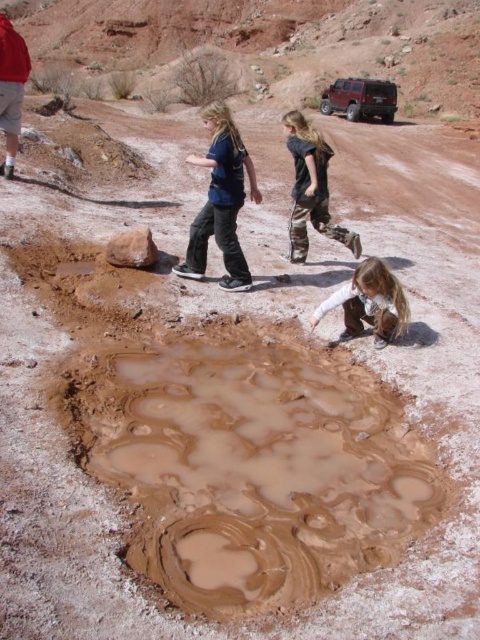
Question: Considering the real-world distances, which object is closest to the matte red shirt at upper left?

Choices:
 (A) light brown fabric pants at lower center
 (B) muddy wet puddle at center

Answer: (A)

Question: Estimate the real-world distances between objects in this image. Which object is farther from the blue cotton shirt at center?

Choices:
 (A) light brown fabric pants at lower center
 (B) matte red shirt at upper left
 (C) dark blue jeans at center

Answer: (B)

Question: Is dark blue jeans at center above light brown fabric pants at lower center?

Choices:
 (A) no
 (B) yes

Answer: (B)

Question: Is muddy wet puddle at center bigger than blue cotton shirt at center?

Choices:
 (A) no
 (B) yes

Answer: (A)

Question: Can you confirm if muddy wet puddle at center is smaller than dark blue jeans at center?

Choices:
 (A) yes
 (B) no

Answer: (A)

Question: Which object is the closest to the dark blue jeans at center?

Choices:
 (A) blue cotton shirt at center
 (B) matte red shirt at upper left
 (C) light brown fabric pants at lower center

Answer: (A)